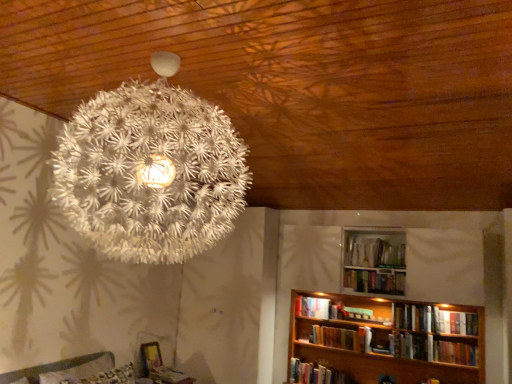
Find the location of `vacant point above hardcover book at center, the fifth book when ordered from right to left (from a real-world perspective)`. vacant point above hardcover book at center, the fifth book when ordered from right to left (from a real-world perspective) is located at coordinates (334, 328).